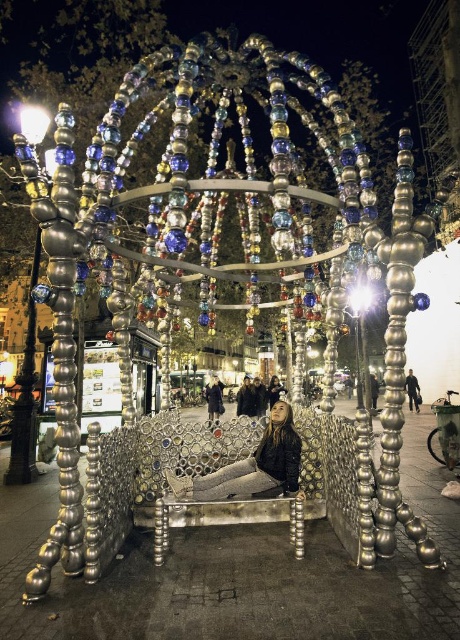
Who is positioned more to the right, dark blue fabric coat at center or dark gray jacket at lower right?

dark gray jacket at lower right

Does dark blue fabric coat at center appear on the right side of dark gray jacket at lower right?

In fact, dark blue fabric coat at center is to the left of dark gray jacket at lower right.

Is point (219, 385) positioned after point (419, 394)?

Yes.

This screenshot has width=460, height=640. I want to click on dark blue fabric coat at center, so click(x=213, y=397).

Which of these two, dark brown leather jacket at center or dark gray jacket at lower right, stands taller?

dark gray jacket at lower right is taller.

Can you confirm if dark brown leather jacket at center is shorter than dark gray jacket at lower right?

Correct, dark brown leather jacket at center is not as tall as dark gray jacket at lower right.

Between point (245, 380) and point (415, 384), which one is positioned in front?

Point (415, 384) is in front.

At what (x,y) coordinates should I click in order to perform the action: click on dark brown leather jacket at center. Please return your answer as a coordinate pair (x, y). The width and height of the screenshot is (460, 640). Looking at the image, I should click on (246, 400).

Can you confirm if dark blue fabric coat at center is smaller than dark brown leather jacket at center?

Indeed, dark blue fabric coat at center has a smaller size compared to dark brown leather jacket at center.

Does point (217, 392) come closer to viewer compared to point (247, 413)?

That is False.

At what (x,y) coordinates should I click in order to perform the action: click on dark blue fabric coat at center. Please return your answer as a coordinate pair (x, y). Looking at the image, I should click on (213, 397).